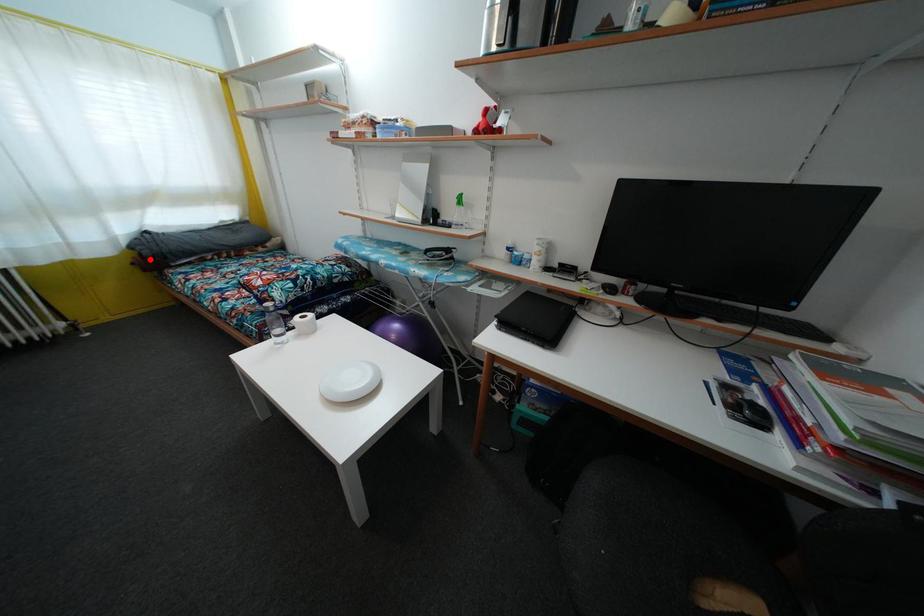
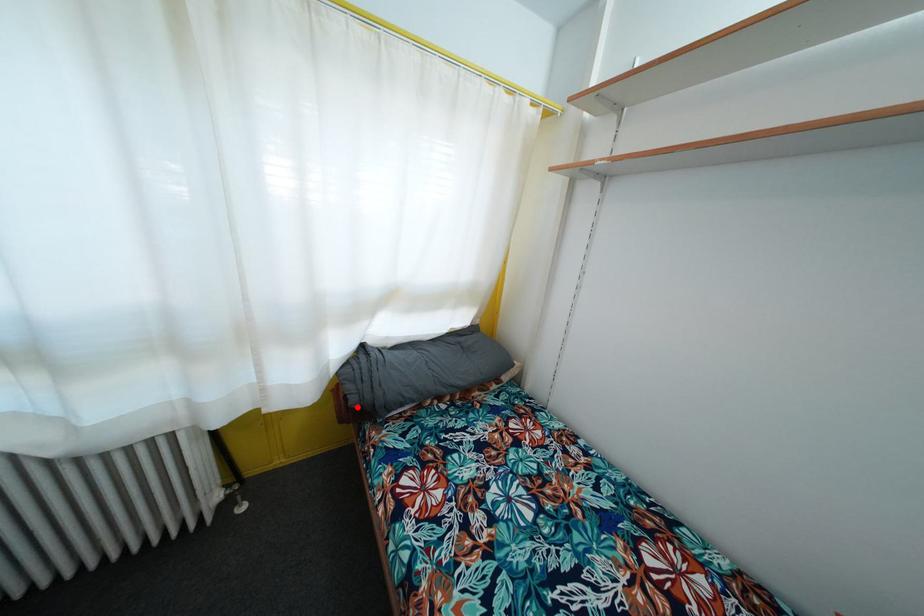
I am providing you with two images of the same scene from different viewpoints. A red point is marked on the first image and another point is marked on the second image. Do the highlighted points in image1 and image2 indicate the same real-world spot?

Yes